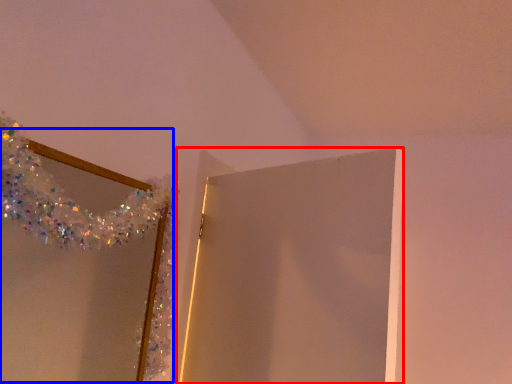
Question: Which object is closer to the camera taking this photo, door (highlighted by a red box) or mirror (highlighted by a blue box)?

Choices:
 (A) door
 (B) mirror

Answer: (B)